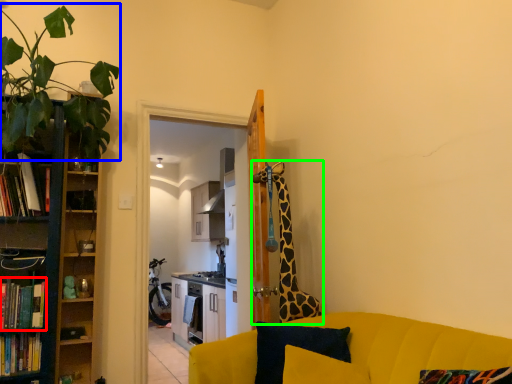
Question: Which object is positioned closest to book (highlighted by a red box)? Select from plant (highlighted by a blue box) and giraffe (highlighted by a green box).

Choices:
 (A) plant
 (B) giraffe

Answer: (A)